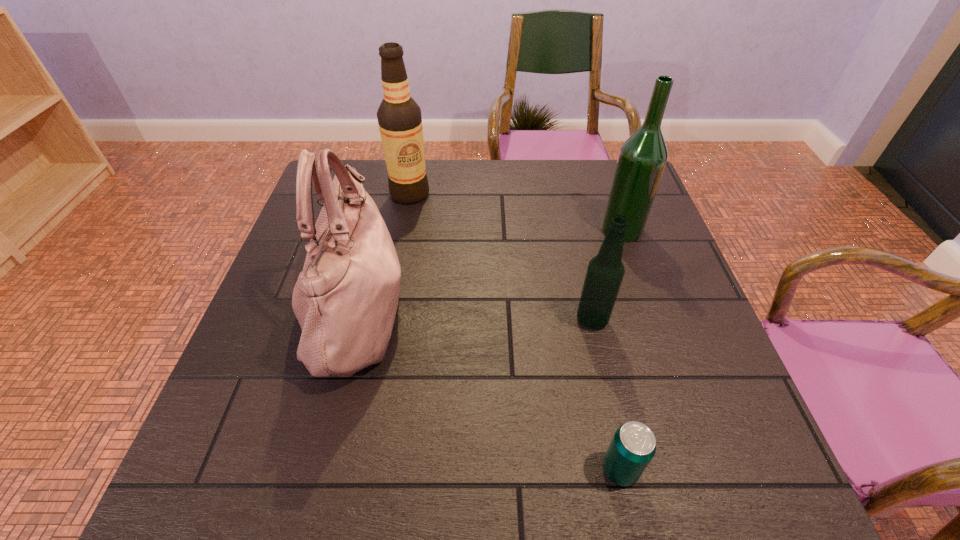
The height and width of the screenshot is (540, 960). In order to click on vacant point located 0.250m on the back of the rightmost alcohol in this screenshot , I will do `click(600, 168)`.

Image resolution: width=960 pixels, height=540 pixels. Identify the location of blank area located at the front of the handbag with handles. pos(443,310).

Where is `free space located 0.130m on the back of the nearest alcohol`? The image size is (960, 540). free space located 0.130m on the back of the nearest alcohol is located at coordinates (580, 267).

Locate an element on the screen. free space located 0.150m on the left of the beer can is located at coordinates (515, 469).

Identify the location of object located in the far edge section of the desktop. The width and height of the screenshot is (960, 540). (399, 117).

At what (x,y) coordinates should I click in order to perform the action: click on object situated at the near edge. Please return your answer as a coordinate pair (x, y). The width and height of the screenshot is (960, 540). Looking at the image, I should click on 633,446.

This screenshot has height=540, width=960. In order to click on object that is at the left edge in this screenshot , I will do click(x=345, y=299).

Locate an element on the screen. object present at the right edge is located at coordinates (642, 158).

In the image, there is a desktop. Where is `vacant space at the far edge`? The height and width of the screenshot is (540, 960). vacant space at the far edge is located at coordinates (520, 176).

The height and width of the screenshot is (540, 960). In order to click on vacant position at the near edge of the desktop in this screenshot , I will do `click(553, 454)`.